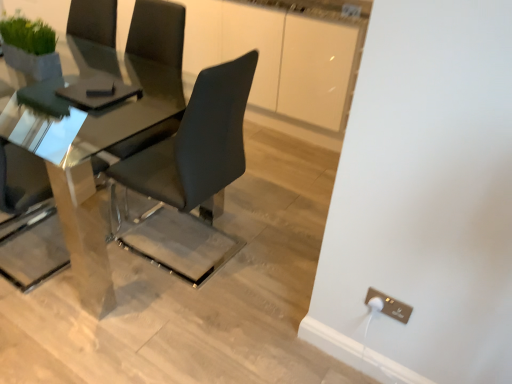
Describe the element at coordinates (391, 306) in the screenshot. The image size is (512, 384). I see `metallic gold electrical outlet at lower right` at that location.

Where is `matte black chair at center`? Image resolution: width=512 pixels, height=384 pixels. matte black chair at center is located at coordinates (191, 176).

Identify the location of polished glass table at center. (102, 155).

Image resolution: width=512 pixels, height=384 pixels. What are the coordinates of `metallic gold electrical outlet at lower right` in the screenshot? It's located at (391, 306).

From a real-world perspective, between matte black chair at center and polished glass table at center, who is vertically higher?

matte black chair at center is physically above.

Locate an element on the screen. The width and height of the screenshot is (512, 384). table lying above the matte black chair at center (from the image's perspective) is located at coordinates (102, 155).

Considering their positions, is matte black chair at center located in front of or behind polished glass table at center?

matte black chair at center is in front of polished glass table at center.

Can you confirm if matte black chair at center is positioned to the right of polished glass table at center?

Yes, matte black chair at center is to the right of polished glass table at center.

Is metallic gold electrical outlet at lower right oriented towards polished glass table at center?

No.

Who is taller, metallic gold electrical outlet at lower right or polished glass table at center?

polished glass table at center.

From a real-world perspective, which object rests below the other?

From a 3D spatial view, metallic gold electrical outlet at lower right is below.

Relative to matte black chair at center, is polished glass table at center in front or behind?

→ polished glass table at center is behind matte black chair at center.

Between polished glass table at center and matte black chair at center, which one has larger size?

Bigger between the two is polished glass table at center.

Consider the image. From a real-world perspective, who is located higher, polished glass table at center or matte black chair at center?

In real-world perspective, matte black chair at center is above.

Consider the image. From a real-world perspective, which object rests below the other?

metallic gold electrical outlet at lower right.

Is metallic gold electrical outlet at lower right positioned far away from matte black chair at center?

They are positioned close to each other.

Based on their sizes in the image, would you say metallic gold electrical outlet at lower right is bigger or smaller than matte black chair at center?

In the image, metallic gold electrical outlet at lower right appears to be smaller than matte black chair at center.

Consider the image. Considering the positions of objects metallic gold electrical outlet at lower right and matte black chair at center in the image provided, who is more to the right, metallic gold electrical outlet at lower right or matte black chair at center?

Positioned to the right is metallic gold electrical outlet at lower right.

Which object is wider, polished glass table at center or metallic gold electrical outlet at lower right?

polished glass table at center.

Considering the relative sizes of polished glass table at center and metallic gold electrical outlet at lower right in the image provided, is polished glass table at center shorter than metallic gold electrical outlet at lower right?

No, polished glass table at center is not shorter than metallic gold electrical outlet at lower right.

Is polished glass table at center not within metallic gold electrical outlet at lower right?

Yes, polished glass table at center is not within metallic gold electrical outlet at lower right.

From a real-world perspective, who is located higher, polished glass table at center or metallic gold electrical outlet at lower right?

In real-world perspective, polished glass table at center is above.

Is matte black chair at center positioned with its back to metallic gold electrical outlet at lower right?

That's right, matte black chair at center is facing away from metallic gold electrical outlet at lower right.

Considering the sizes of objects matte black chair at center and metallic gold electrical outlet at lower right in the image provided, who is thinner, matte black chair at center or metallic gold electrical outlet at lower right?

With smaller width is metallic gold electrical outlet at lower right.

Is point (187, 158) closer or farther from the camera than point (384, 296)?

Point (187, 158) appears to be farther away from the viewer than point (384, 296).

Locate an element on the screen. chair below the polished glass table at center (from the image's perspective) is located at coordinates (191, 176).

Locate an element on the screen. electric outlet lying behind the polished glass table at center is located at coordinates (391, 306).

Looking at the image, which one is located further to metallic gold electrical outlet at lower right, polished glass table at center or matte black chair at center?

Based on the image, polished glass table at center appears to be further to metallic gold electrical outlet at lower right.

Based on their spatial positions, is matte black chair at center or polished glass table at center further from metallic gold electrical outlet at lower right?

Among the two, polished glass table at center is located further to metallic gold electrical outlet at lower right.

Based on their spatial positions, is metallic gold electrical outlet at lower right or matte black chair at center further from polished glass table at center?

Based on the image, metallic gold electrical outlet at lower right appears to be further to polished glass table at center.

From the image, which object appears to be farther from matte black chair at center, polished glass table at center or metallic gold electrical outlet at lower right?

metallic gold electrical outlet at lower right lies further to matte black chair at center than the other object.

Considering their positions, is metallic gold electrical outlet at lower right positioned further to matte black chair at center than polished glass table at center?

The object further to matte black chair at center is metallic gold electrical outlet at lower right.

From the image, which object appears to be farther from polished glass table at center, matte black chair at center or metallic gold electrical outlet at lower right?

The object further to polished glass table at center is metallic gold electrical outlet at lower right.

The height and width of the screenshot is (384, 512). Identify the location of chair located between polished glass table at center and metallic gold electrical outlet at lower right in the left-right direction. (191, 176).